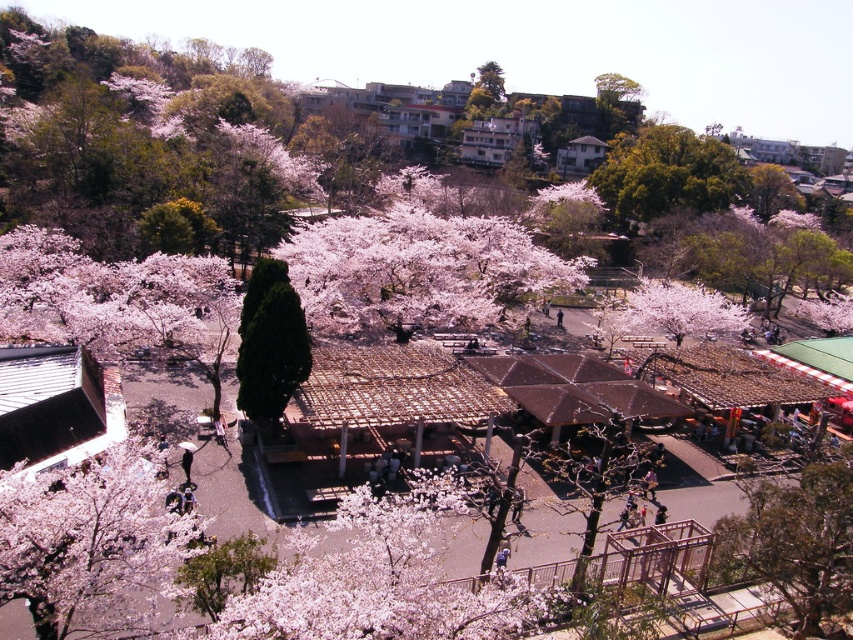
You are planning to take a photo of the pink matte flower at center and the green textured tree at lower right. Which object should you focus on first if you want to capture both in a single frame without moving the camera?

The pink matte flower at center is bigger than the green textured tree at lower right, so you should focus on the pink matte flower at center first to ensure it is clearly visible in the frame.

You are walking along a path in the cherry blossom area and see the fluffy pink blossoms at lower left and the bare wood tree at center. Which one is positioned more to the left side?

The fluffy pink blossoms at lower left are positioned more to the left side than the bare wood tree at center.

You are a photographer trying to capture a shot of the pink matte flower at center and the green textured tree at lower right. From your current position, which object is positioned to the left of the other?

The pink matte flower at center is to the left of the green textured tree at lower right.